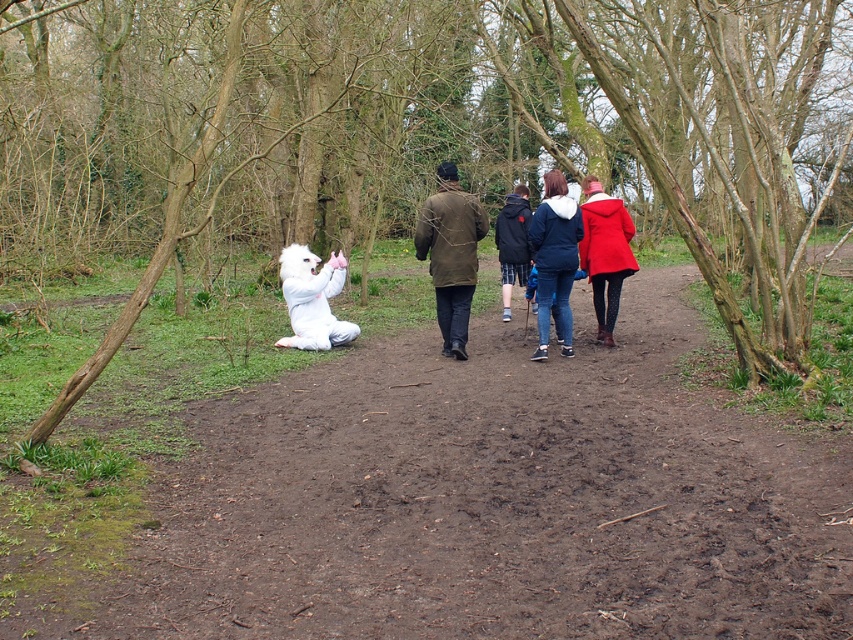
Question: Is denim jacket at center to the right of dark blue denim jacket at center from the viewer's perspective?

Choices:
 (A) no
 (B) yes

Answer: (B)

Question: Which point is farther to the camera?

Choices:
 (A) white plush at center
 (B) dark blue denim jacket at center
 (C) denim jacket at center

Answer: (B)

Question: Is brown bark tree at lower left below red woolen coat at center?

Choices:
 (A) yes
 (B) no

Answer: (B)

Question: Which point is closer to the camera taking this photo?

Choices:
 (A) (329, 275)
 (B) (521, 208)

Answer: (A)

Question: Which point appears farthest from the camera in this image?

Choices:
 (A) (538, 227)
 (B) (508, 308)
 (C) (583, 253)
 (D) (456, 227)

Answer: (B)

Question: Is the position of brown bark tree at lower left more distant than that of dark blue denim jacket at center?

Choices:
 (A) no
 (B) yes

Answer: (A)